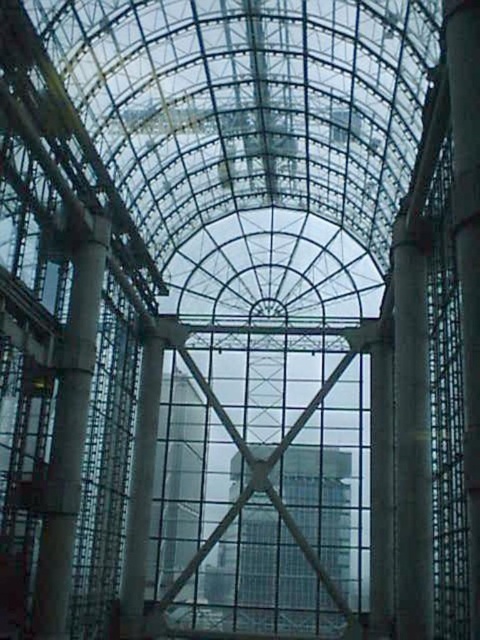
Question: Can you confirm if smooth concrete pillar at center is bigger than smooth gray concrete pillar at right?

Choices:
 (A) no
 (B) yes

Answer: (A)

Question: Which object is closer to the camera taking this photo?

Choices:
 (A) smooth gray concrete pillar at right
 (B) smooth concrete pillar at center
 (C) concrete pillar at left

Answer: (A)

Question: Which point is closer to the camera?

Choices:
 (A) smooth concrete pillar at center
 (B) smooth gray concrete pillar at right

Answer: (B)

Question: Which of the following is the closest to the observer?

Choices:
 (A) concrete pillar at left
 (B) smooth gray concrete pillar at right
 (C) smooth concrete pillar at center

Answer: (B)

Question: Can you confirm if concrete pillar at left is wider than smooth gray concrete pillar at right?

Choices:
 (A) no
 (B) yes

Answer: (B)

Question: Is concrete pillar at left below smooth gray concrete pillar at right?

Choices:
 (A) yes
 (B) no

Answer: (A)